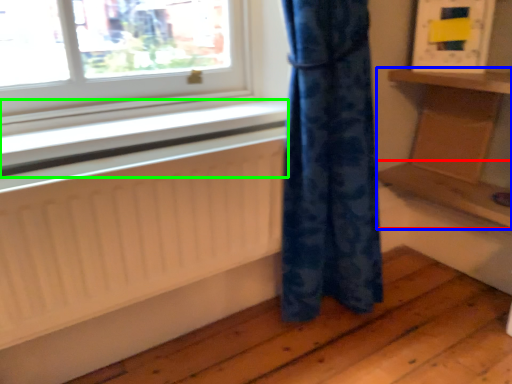
Question: Which is nearer to the shelf (highlighted by a red box)? furniture (highlighted by a blue box) or window sill (highlighted by a green box).

Choices:
 (A) furniture
 (B) window sill

Answer: (A)